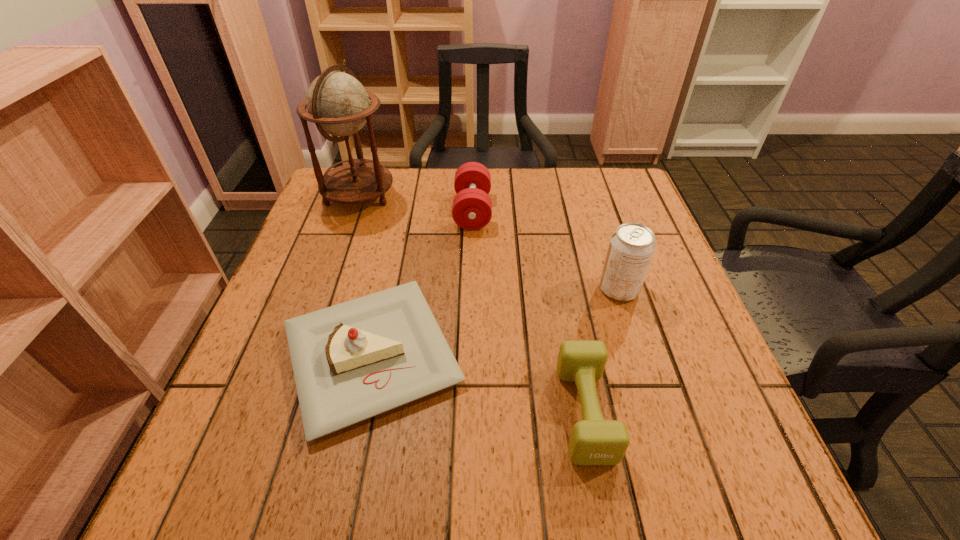
Locate an element on the screen. The height and width of the screenshot is (540, 960). free space between the tallest object and the left dumbbell is located at coordinates (416, 203).

Locate an element on the screen. The width and height of the screenshot is (960, 540). empty space that is in between the right dumbbell and the tallest object is located at coordinates (472, 303).

Find the location of `free space between the soda can and the farther dumbbell`. free space between the soda can and the farther dumbbell is located at coordinates (546, 250).

Identify the location of vacant area that lies between the taller dumbbell and the globe. (416, 203).

This screenshot has width=960, height=540. I want to click on free spot between the left dumbbell and the cake, so click(422, 283).

Locate an element on the screen. free point between the taller dumbbell and the second tallest object is located at coordinates (546, 250).

The height and width of the screenshot is (540, 960). I want to click on free spot between the cake and the soda can, so click(495, 322).

You are a GUI agent. You are given a task and a screenshot of the screen. Output one action in this format:
    pyautogui.click(x=<x>, y=<y>)
    Task: Click on the object that stands as the fourth closest to the taller dumbbell
    
    Given the screenshot: What is the action you would take?
    pyautogui.click(x=594, y=441)

This screenshot has height=540, width=960. I want to click on object that stands as the fourth closest to the second tallest object, so 338,104.

Locate an element on the screen. The image size is (960, 540). vacant area in the image that satisfies the following two spatial constraints: 1. on the surface of the nearer dumbbell; 2. on the right side of the tallest object is located at coordinates (282, 412).